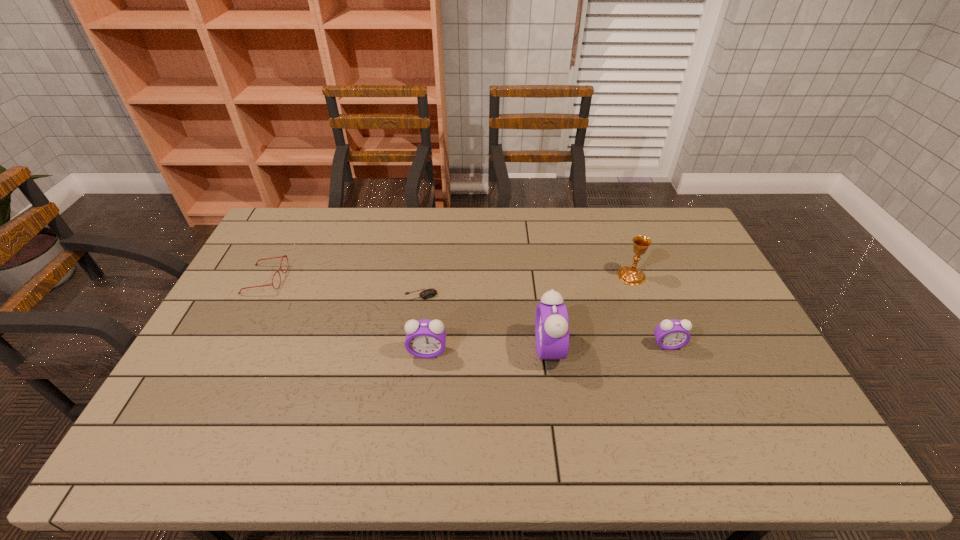
Identify the location of the fourth closest object to the chalice. The image size is (960, 540). (425, 338).

Select which alarm clock is the closest to the third object from right to left. Please provide its 2D coordinates. Your answer should be formatted as a tuple, i.e. [(x, y)], where the tuple contains the x and y coordinates of a point satisfying the conditions above.

[(425, 338)]

At what (x,y) coordinates should I click in order to perform the action: click on alarm clock that is the second closest to the leftmost object. Please return your answer as a coordinate pair (x, y). Looking at the image, I should click on (551, 321).

Locate an element on the screen. This screenshot has width=960, height=540. vacant space that satisfies the following two spatial constraints: 1. on the face of the shortest alarm clock; 2. on the face of the fourth object from left to right is located at coordinates (669, 348).

Where is `free space that satisfies the following two spatial constraints: 1. on the back side of the mouse; 2. on the face of the leftmost object`? free space that satisfies the following two spatial constraints: 1. on the back side of the mouse; 2. on the face of the leftmost object is located at coordinates (423, 279).